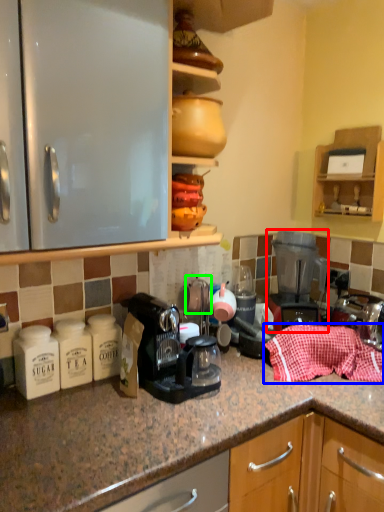
Question: Based on their relative distances, which object is nearer to home appliance (highlighted by a red box)? Choose from material (highlighted by a blue box) and tea pot (highlighted by a green box).

Choices:
 (A) material
 (B) tea pot

Answer: (A)